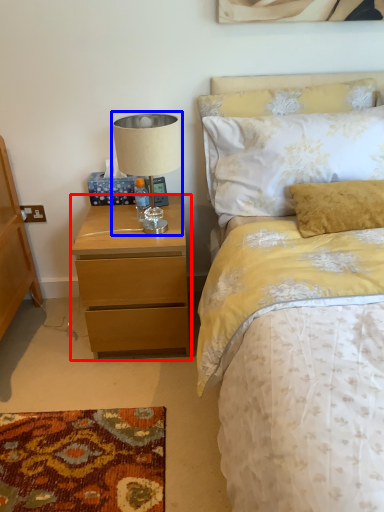
Question: Which object appears closest to the camera in this image, nightstand (highlighted by a red box) or table lamp (highlighted by a blue box)?

Choices:
 (A) nightstand
 (B) table lamp

Answer: (B)